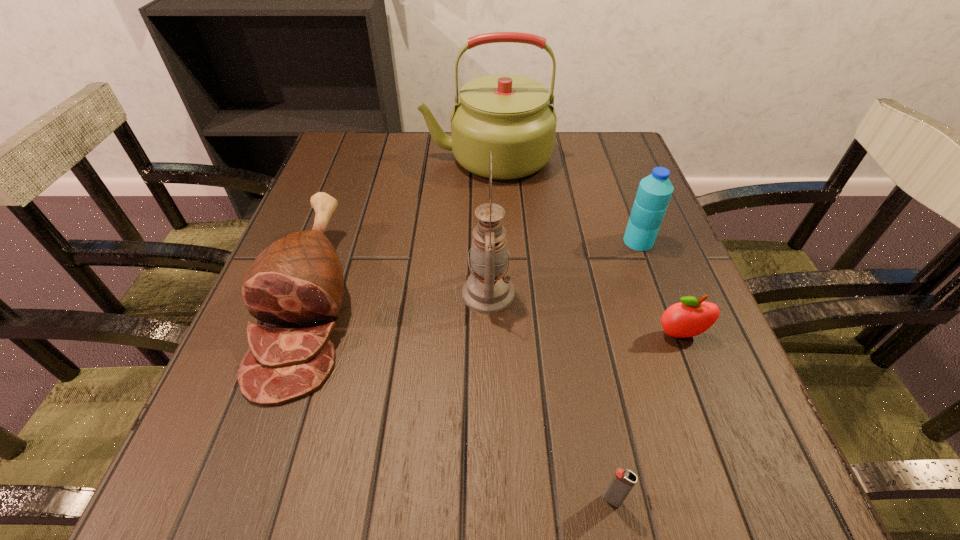
This screenshot has width=960, height=540. I want to click on apple present at the right edge, so click(690, 317).

You are a GUI agent. You are given a task and a screenshot of the screen. Output one action in this format:
    pyautogui.click(x=<x>, y=<y>)
    Task: Click on the vacant space at the far edge of the desktop
    This screenshot has height=540, width=960.
    Given the screenshot: What is the action you would take?
    pyautogui.click(x=395, y=157)

In the image, there is a desktop. Where is `vacant space at the near edge`? vacant space at the near edge is located at coordinates point(632,495).

The image size is (960, 540). In order to click on vacant space at the left edge in this screenshot , I will do `click(351, 226)`.

This screenshot has width=960, height=540. I want to click on free spot at the right edge of the desktop, so click(686, 382).

Where is `vacant space at the far right corner of the desktop`? The image size is (960, 540). vacant space at the far right corner of the desktop is located at coordinates (587, 134).

The width and height of the screenshot is (960, 540). I want to click on free space between the fifth tallest object and the igniter, so click(x=646, y=417).

What are the coordinates of `free space between the water bottle and the oil lamp` in the screenshot? It's located at (564, 267).

Locate an element on the screen. vacant space that is in between the leftmost object and the apple is located at coordinates (495, 318).

Locate an element on the screen. Image resolution: width=960 pixels, height=540 pixels. free space between the apple and the oil lamp is located at coordinates (585, 314).